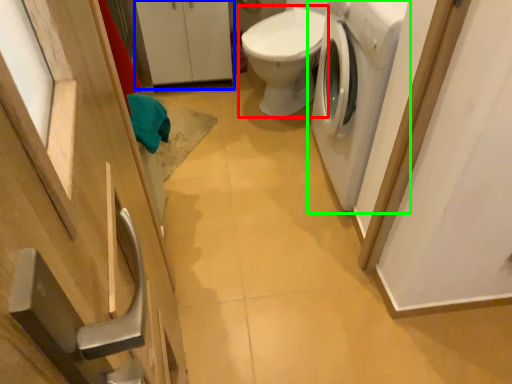
Question: Estimate the real-world distances between objects in this image. Which object is farther from toilet (highlighted by a red box), cabinetry (highlighted by a blue box) or washing machine (highlighted by a green box)?

Choices:
 (A) cabinetry
 (B) washing machine

Answer: (A)